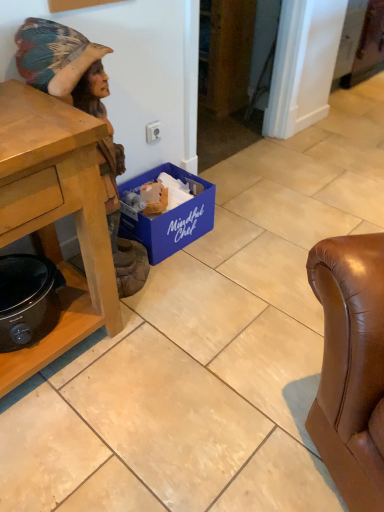
I want to click on vacant point to the right of wooden statue at left, so click(x=190, y=280).